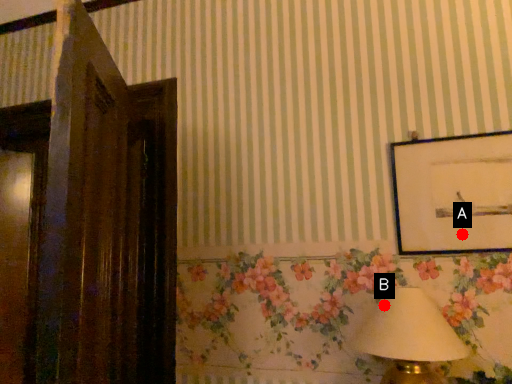
Question: Two points are circled on the image, labeled by A and B beside each circle. Which point is farther to the camera?

Choices:
 (A) A is further
 (B) B is further

Answer: (A)